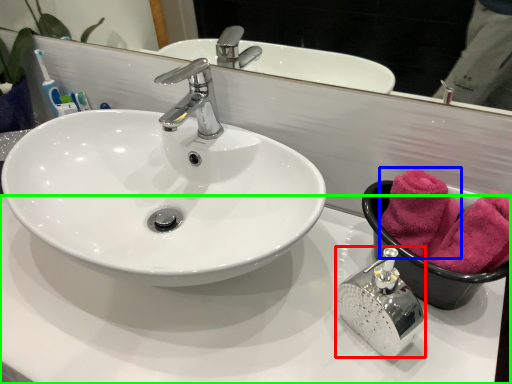
Question: Which object is the farthest from soap dispenser (highlighted by a red box)? Choose among these: bath towel (highlighted by a blue box) or counter top (highlighted by a green box).

Choices:
 (A) bath towel
 (B) counter top

Answer: (B)